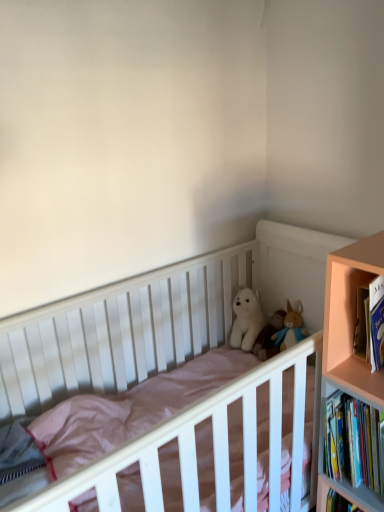
Question: Is white plush bear at center, the second doll from the right, facing towards hardcover books at right?

Choices:
 (A) yes
 (B) no

Answer: (B)

Question: Can you confirm if white plush bear at center, the second doll from the right, is shorter than hardcover books at right?

Choices:
 (A) no
 (B) yes

Answer: (B)

Question: From a real-world perspective, is white plush bear at center, the second doll from the right, on hardcover books at right?

Choices:
 (A) yes
 (B) no

Answer: (B)

Question: Is white plush bear at center, the second doll from the right, placed right next to hardcover books at right?

Choices:
 (A) yes
 (B) no

Answer: (B)

Question: Is white plush bear at center, the second doll from the right, thinner than hardcover books at right?

Choices:
 (A) no
 (B) yes

Answer: (B)

Question: Does white plush bear at center, the second doll from the right, have a smaller size compared to hardcover books at right?

Choices:
 (A) yes
 (B) no

Answer: (A)

Question: Is white plush toy at center looking in the opposite direction of hardcover books at right?

Choices:
 (A) no
 (B) yes

Answer: (A)

Question: Is white plush toy at center not near hardcover books at right?

Choices:
 (A) no
 (B) yes

Answer: (A)

Question: Is white plush toy at center outside of hardcover books at right?

Choices:
 (A) no
 (B) yes

Answer: (B)

Question: Is white plush toy at center shorter than hardcover books at right?

Choices:
 (A) yes
 (B) no

Answer: (A)

Question: Does white plush toy at center have a lesser width compared to hardcover books at right?

Choices:
 (A) yes
 (B) no

Answer: (A)

Question: Is white plush toy at center aimed at hardcover books at right?

Choices:
 (A) no
 (B) yes

Answer: (A)

Question: Considering the relative sizes of white plush bear at center, which is the first doll from right to left, and pink wood bookcase at right in the image provided, is white plush bear at center, which is the first doll from right to left, smaller than pink wood bookcase at right?

Choices:
 (A) yes
 (B) no

Answer: (A)